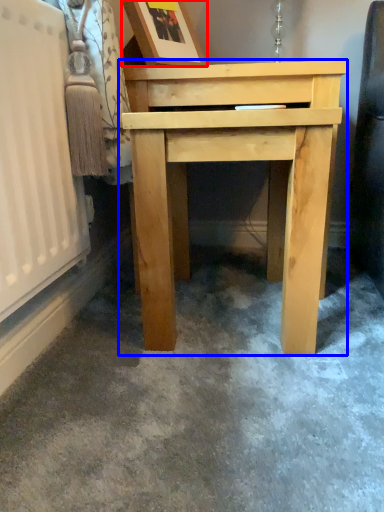
Question: Which point is closer to the camera, picture frame (highlighted by a red box) or table (highlighted by a blue box)?

Choices:
 (A) picture frame
 (B) table

Answer: (B)